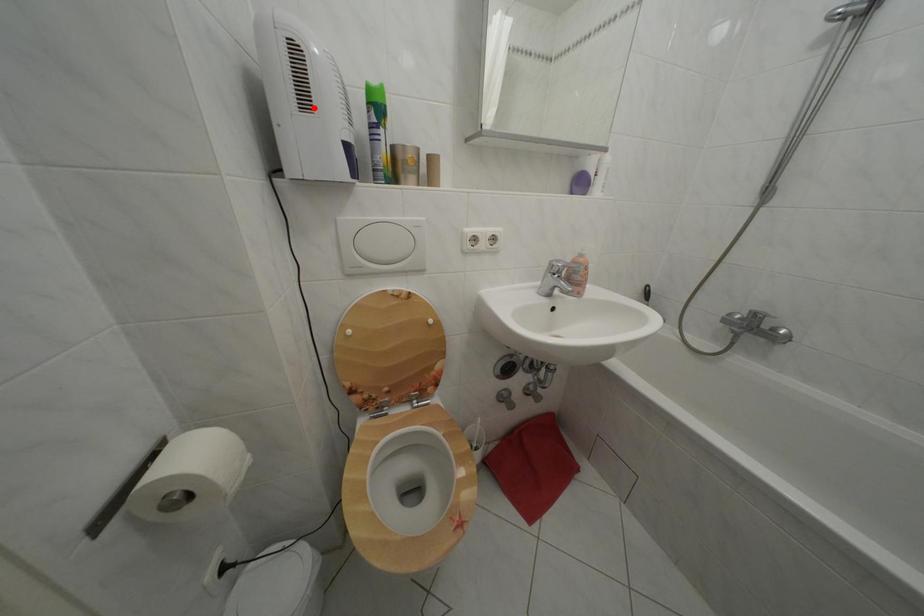
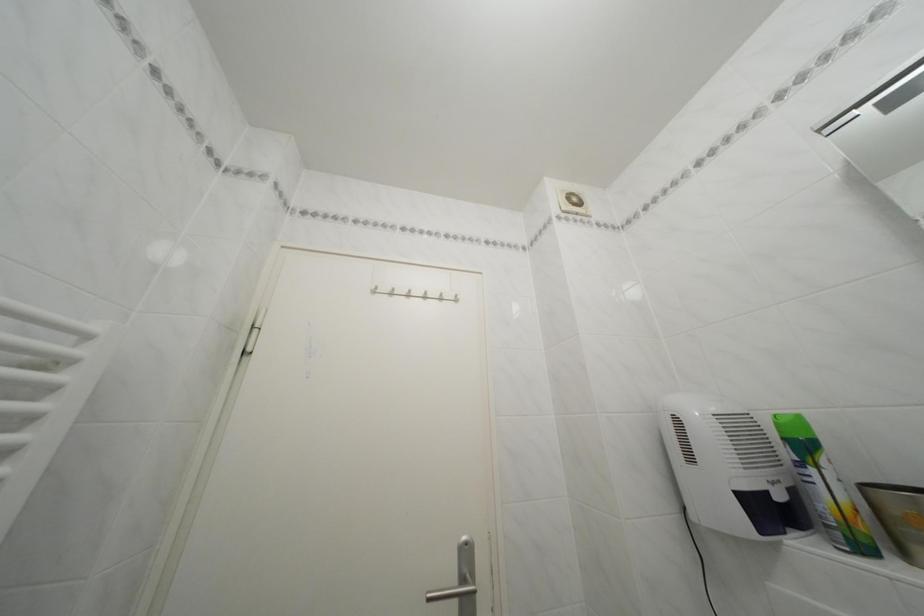
In the second image, find the point that corresponds to the highlighted location in the first image.

(699, 464)